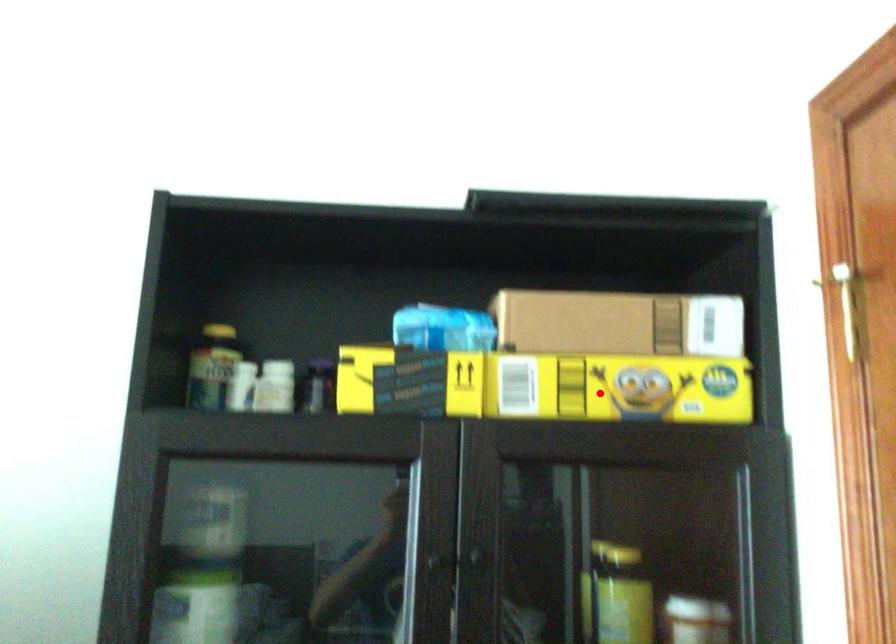
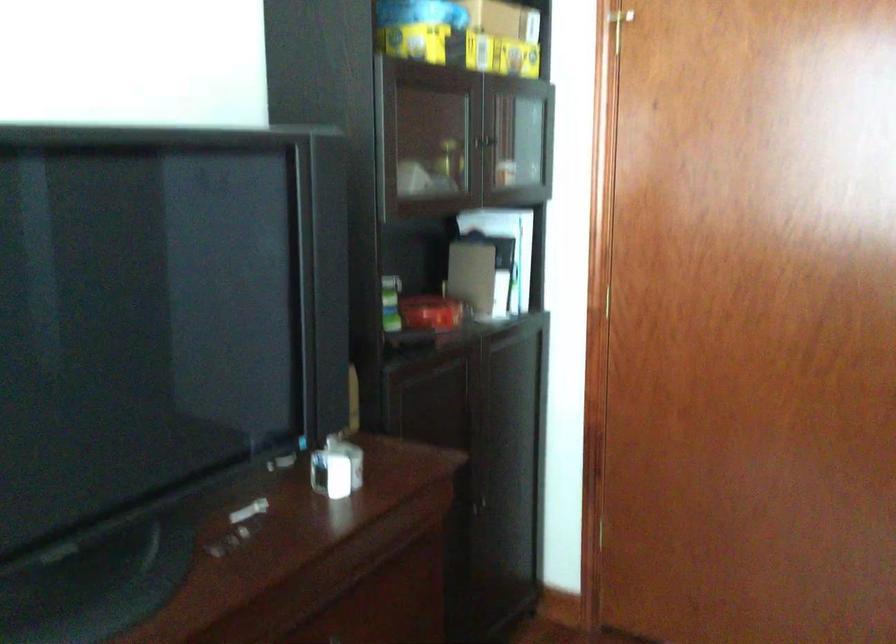
Question: I am providing you with two images of the same scene from different viewpoints. In image1, a red point is highlighted. Considering the same 3D point in image2, which of the following is correct?

Choices:
 (A) It is closer
 (B) It is farther

Answer: (B)